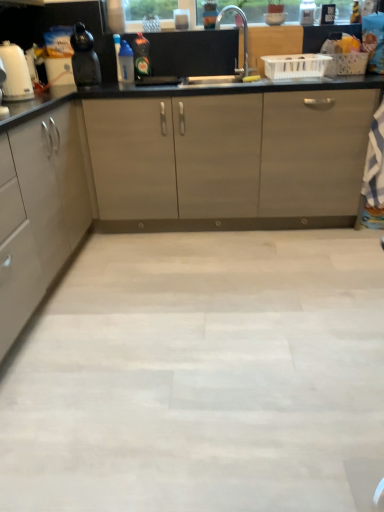
Question: Does point click(3, 49) appear closer or farther from the camera than point click(142, 47)?

Choices:
 (A) closer
 (B) farther

Answer: (A)

Question: From a real-world perspective, is white glossy kettle at left physically located above or below green glass bottle at center, the 2th bottle positioned from the left?

Choices:
 (A) below
 (B) above

Answer: (A)

Question: Which object is positioned farthest from the green glass bottle at center, the 2th bottle positioned from the left?

Choices:
 (A) blue plastic bottle at upper center, marked as the 1th bottle in a left-to-right arrangement
 (B) matte gray cabinet at left
 (C) silver metallic faucet at upper center
 (D) matte black kettle at left
 (E) white glossy kettle at left

Answer: (B)

Question: Estimate the real-world distances between objects in this image. Which object is farther from the matte black kettle at left?

Choices:
 (A) blue plastic bottle at upper center, marked as the 1th bottle in a left-to-right arrangement
 (B) green glass bottle at center, the 2th bottle positioned from the left
 (C) silver metallic faucet at upper center
 (D) white glossy kettle at left
 (E) matte gray cabinet at left

Answer: (E)